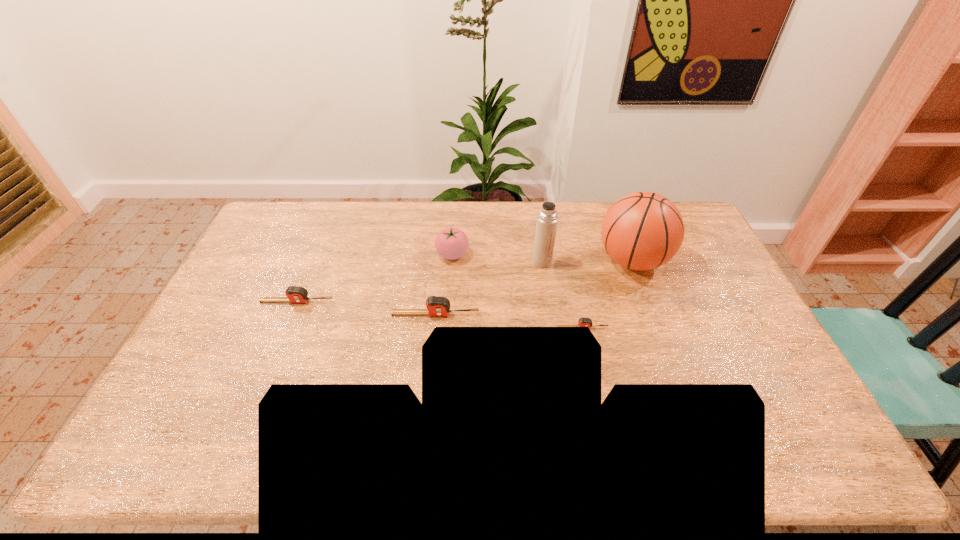
Find the location of a particular element. The width and height of the screenshot is (960, 540). free spot at the near edge of the desktop is located at coordinates (234, 404).

Locate an element on the screen. The image size is (960, 540). free space at the left edge of the desktop is located at coordinates (280, 275).

Locate an element on the screen. This screenshot has width=960, height=540. blank space at the far left corner of the desktop is located at coordinates tap(283, 238).

This screenshot has height=540, width=960. Find the location of `vacant space at the near left corner`. vacant space at the near left corner is located at coordinates (199, 390).

Image resolution: width=960 pixels, height=540 pixels. Find the location of `vacant area at the near right corner`. vacant area at the near right corner is located at coordinates (788, 411).

Identify the location of free space between the leftmost tape measure and the rightmost object. (465, 281).

Locate an element on the screen. Image resolution: width=960 pixels, height=540 pixels. vacant point located between the fourth shortest object and the nearest tape measure is located at coordinates (517, 291).

You are a GUI agent. You are given a task and a screenshot of the screen. Output one action in this format:
    pyautogui.click(x=<x>, y=<y>)
    Task: Click on the free area in between the shortest object and the basketball
    The image size is (960, 540).
    Given the screenshot: What is the action you would take?
    pyautogui.click(x=607, y=294)

Identify the location of empty space between the thermos bottle and the second tape measure from left to right. (489, 288).

Identify the location of unoccupied position between the shortest object and the fifth farthest object. (509, 321).